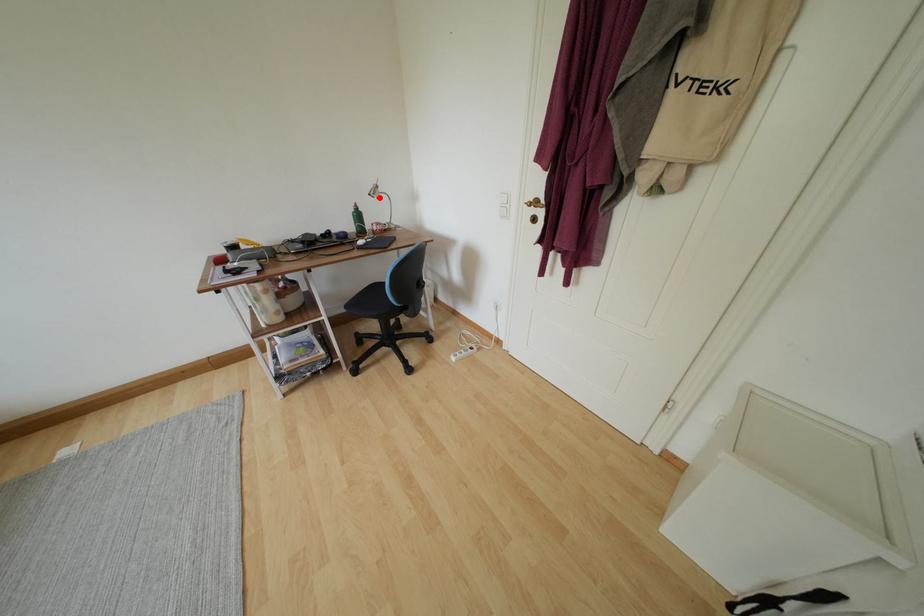
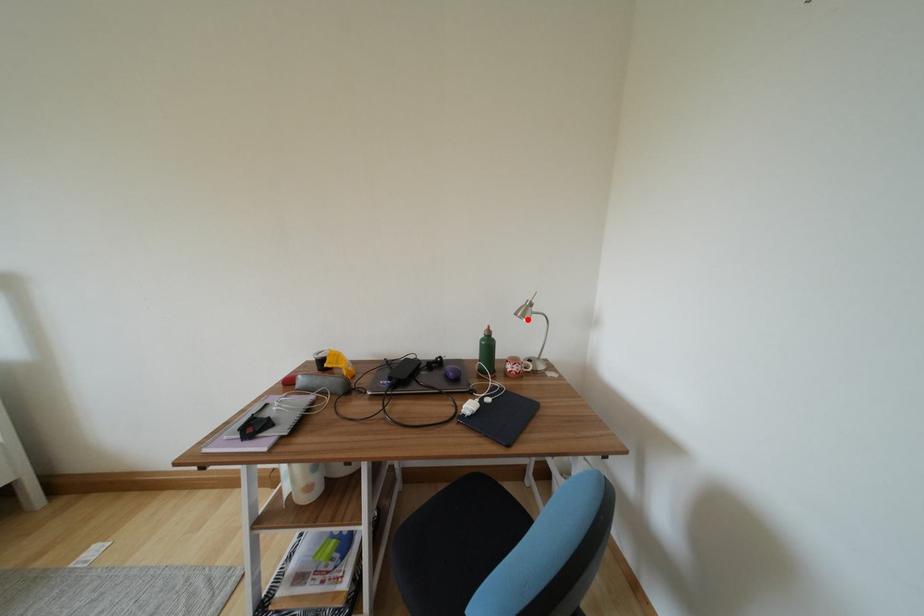
I am providing you with two images of the same scene from different viewpoints. A red point is marked on the first image and another point is marked on the second image. Is the marked point in image1 the same physical position as the marked point in image2?

Yes